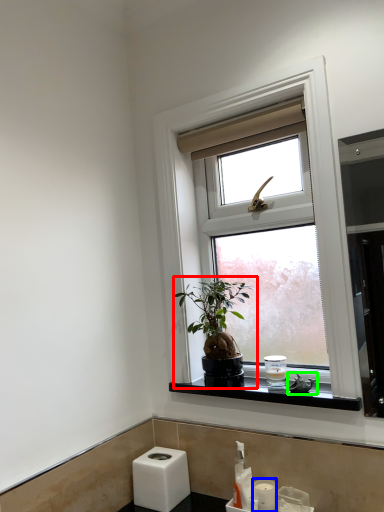
Question: Estimate the real-world distances between objects in this image. Which object is closer to houseplant (highlighted by a red box), toiletry (highlighted by a blue box) or bird (highlighted by a green box)?

Choices:
 (A) toiletry
 (B) bird

Answer: (B)